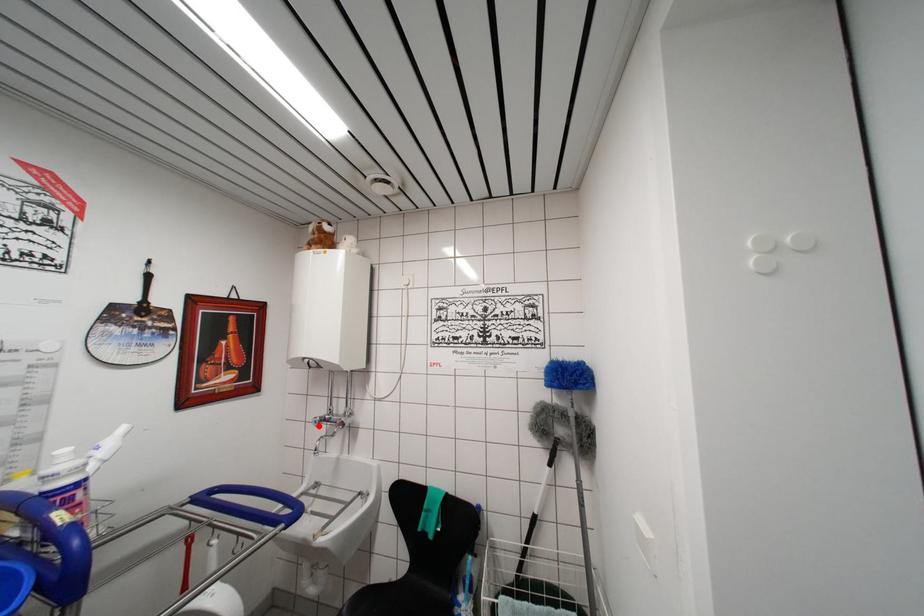
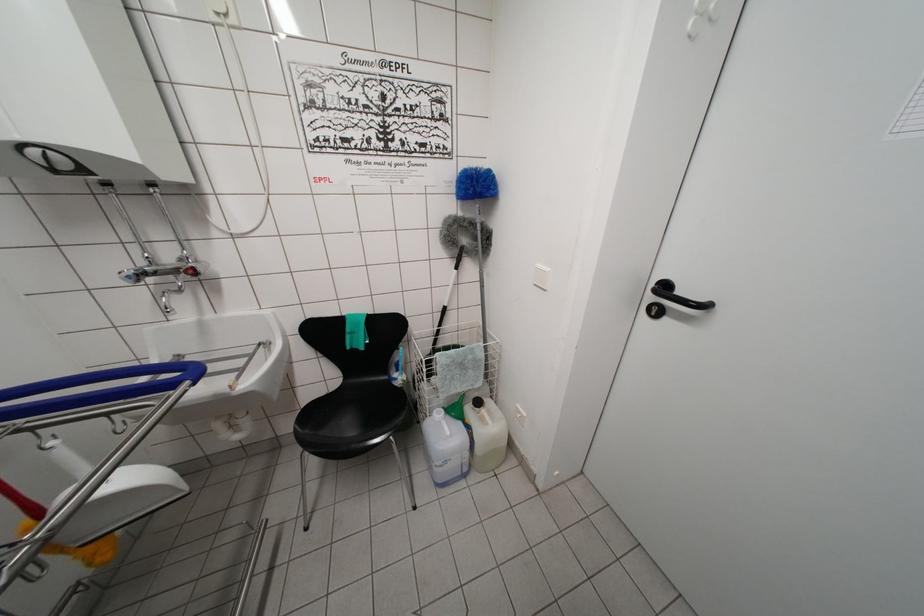
In the second image, find the point that corresponds to the highlighted location in the first image.

(131, 282)